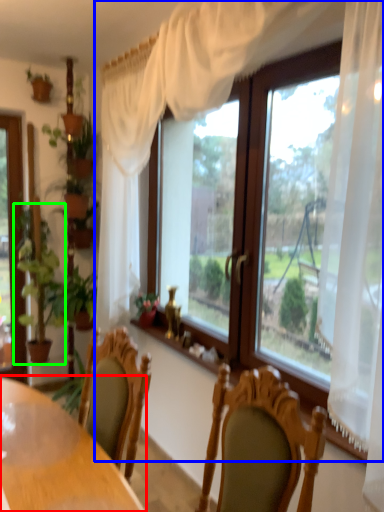
Question: Which is farther away from table (highlighted by a red box)? window (highlighted by a blue box) or houseplant (highlighted by a green box)?

Choices:
 (A) window
 (B) houseplant

Answer: (B)